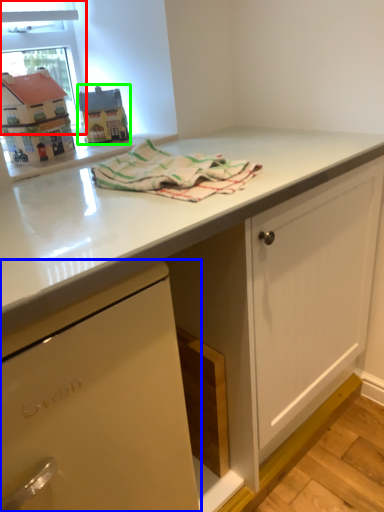
Question: Based on their relative distances, which object is farther from window screen (highlighted by a red box)? Choose from cabinetry (highlighted by a blue box) and appliance (highlighted by a green box).

Choices:
 (A) cabinetry
 (B) appliance

Answer: (A)